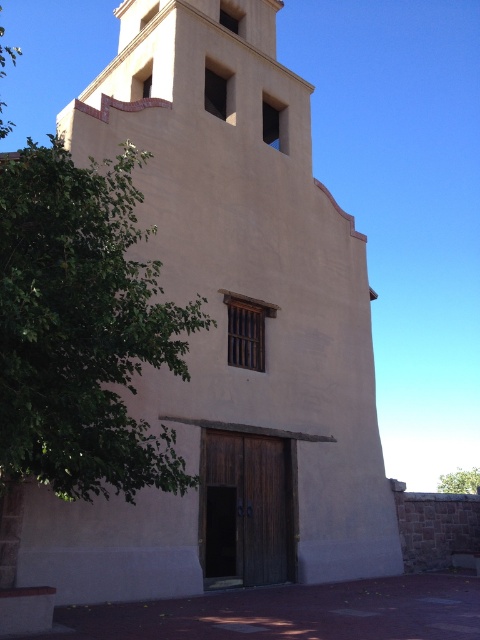
Question: Can you confirm if green leafy tree at left is thinner than green leafy tree at lower right?

Choices:
 (A) no
 (B) yes

Answer: (B)

Question: Which of the following is the closest to the observer?

Choices:
 (A) (1, 355)
 (B) (456, 477)

Answer: (A)

Question: Is green leafy tree at left thinner than green leafy tree at lower right?

Choices:
 (A) no
 (B) yes

Answer: (B)

Question: Which point is closer to the camera?

Choices:
 (A) (134, 323)
 (B) (479, 490)

Answer: (A)

Question: Does green leafy tree at left appear on the right side of green leafy tree at lower right?

Choices:
 (A) yes
 (B) no

Answer: (B)